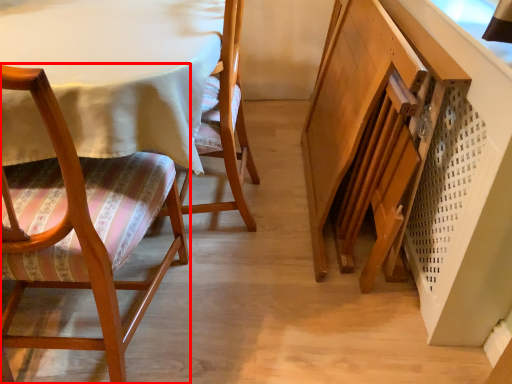
Question: From the image's perspective, what is the correct spatial relationship of chair (annotated by the red box) in relation to chair?

Choices:
 (A) above
 (B) below

Answer: (B)